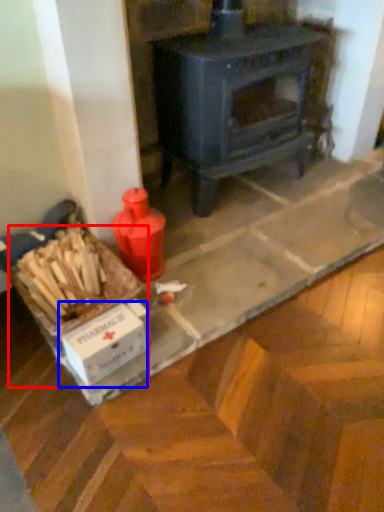
Question: Which point is closer to the camera, box (highlighted by a red box) or cardboard box (highlighted by a blue box)?

Choices:
 (A) box
 (B) cardboard box

Answer: (B)